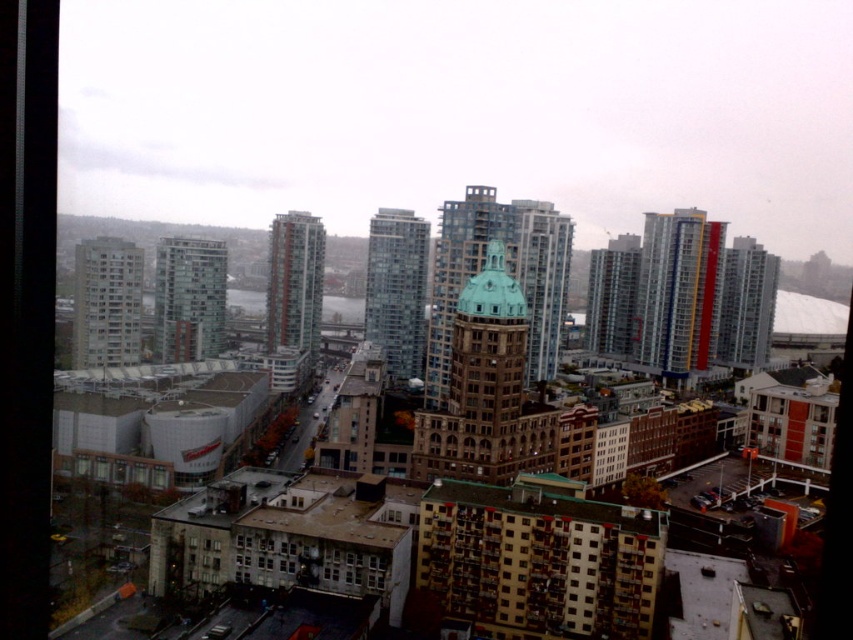
You are an architect evaluating the city skyline. You need to determine which of the two buildings, the glassy teal skyscraper at center or the metallic glass building at right, has a narrower width. Which one would you choose?

The glassy teal skyscraper at center is thinner than the metallic glass building at right, so it has a narrower width.

You are an urban planner assessing the city layout. You need to determine which of the two buildings, the brown textured apartment building at lower center or the glassy reflective skyscraper at center, would require more land area for construction. Based on the scene, which building would need more land?

The glassy reflective skyscraper at center occupies more space than the brown textured apartment building at lower center, so it would require more land area for construction.

You are a drone operator tasked with capturing aerial footage of the city. Your drone can only fly up to 200 meters between two points without needing a battery recharge. You need to fly from the matte glass building at left to the matte glass building at center. Based on the scene, can your drone make this trip without needing to recharge?

The distance between the matte glass building at left and matte glass building at center is 201.79 meters, which exceeds the drone battery range of 200 meters. Therefore, the drone cannot complete the trip without recharging.